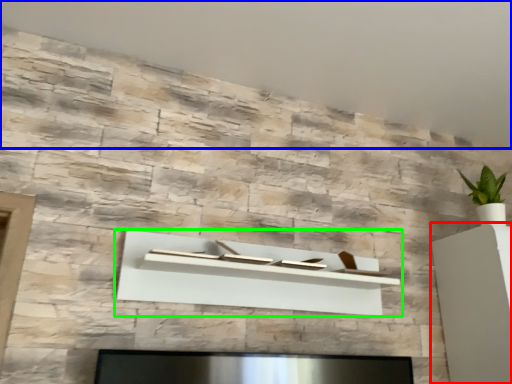
Question: Which object is positioned closest to furniture (highlighted by a red box)? Select from backdrop (highlighted by a blue box) and shelf (highlighted by a green box).

Choices:
 (A) backdrop
 (B) shelf

Answer: (B)